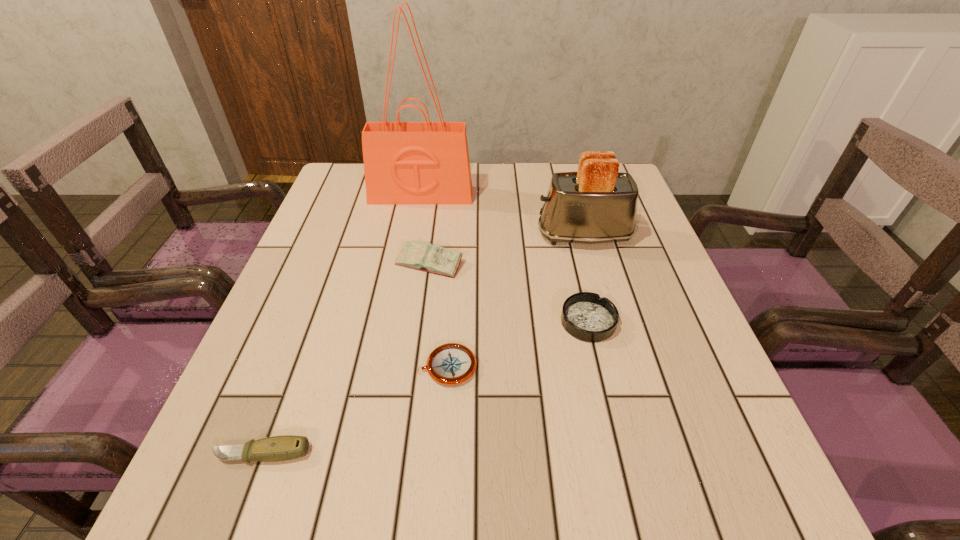
Find the location of a particular element. The height and width of the screenshot is (540, 960). toaster that is at the right edge is located at coordinates (598, 204).

Where is `ashtray that is at the right edge`? This screenshot has height=540, width=960. ashtray that is at the right edge is located at coordinates (586, 316).

Find the location of a particular element. This screenshot has height=540, width=960. object present at the far left corner is located at coordinates (426, 162).

The width and height of the screenshot is (960, 540). I want to click on object present at the near left corner, so click(287, 447).

Identify the location of vacant region at the far edge of the desktop. The image size is (960, 540). (535, 194).

Image resolution: width=960 pixels, height=540 pixels. In the image, there is a desktop. Identify the location of free space at the left edge. (339, 352).

Image resolution: width=960 pixels, height=540 pixels. I want to click on vacant space at the right edge of the desktop, so click(688, 320).

You are a GUI agent. You are given a task and a screenshot of the screen. Output one action in this format:
    pyautogui.click(x=<x>, y=<y>)
    Task: Click on the vacant area that lies between the ashtray and the nearest object
    The width and height of the screenshot is (960, 540).
    Given the screenshot: What is the action you would take?
    pyautogui.click(x=425, y=388)

Locate an element on the screen. vacant space in between the diary and the tallest object is located at coordinates (425, 229).

The height and width of the screenshot is (540, 960). I want to click on free spot between the toaster and the diary, so click(x=507, y=249).